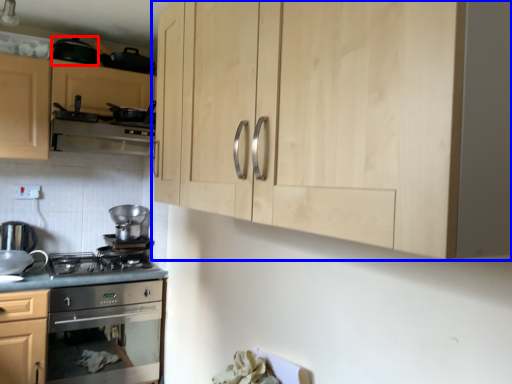
Question: Which object is further to the camera taking this photo, appliance (highlighted by a red box) or cabinetry (highlighted by a blue box)?

Choices:
 (A) appliance
 (B) cabinetry

Answer: (A)